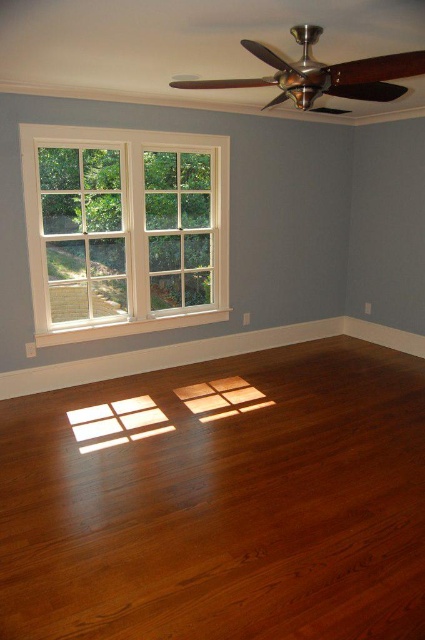
Between shiny brown hardwood floor at center and white painted wood window at left, which one appears on the left side from the viewer's perspective?

From the viewer's perspective, white painted wood window at left appears more on the left side.

Can you confirm if shiny brown hardwood floor at center is smaller than white painted wood window at left?

No, shiny brown hardwood floor at center is not smaller than white painted wood window at left.

Is point (224, 554) positioned before point (206, 195)?

Yes, point (224, 554) is in front of point (206, 195).

Identify the location of shiny brown hardwood floor at center. (223, 506).